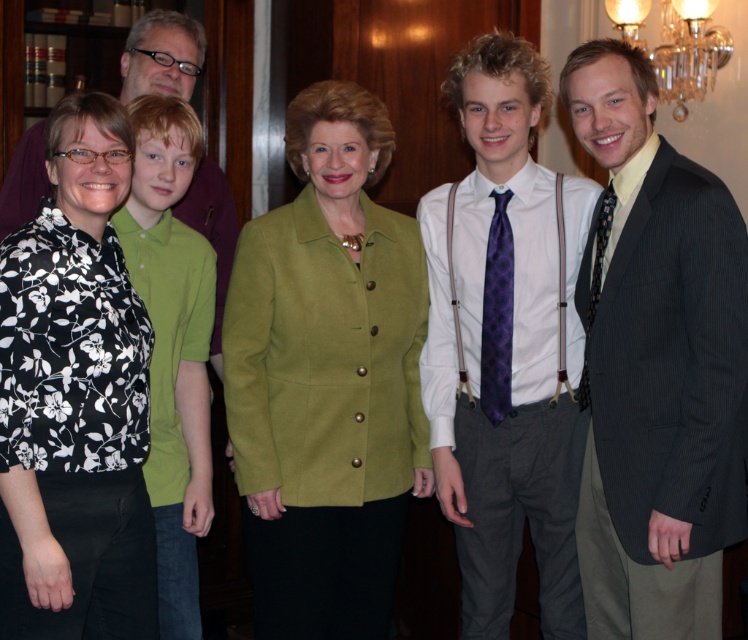
In the image, there are several people posing for a photo. The scene includes a woman in a black floral blouse at left and a young boy in a green short sleeved shirt and jeans. Where is the point at coordinate (73, 397) located in relation to these individuals?

The point at coordinate (73, 397) corresponds to the black floral blouse at left.

You are a photographer setting up for a group photo. You notice the clear crystal chandelier at upper right and the purple woven tie at center. Which object should you adjust your camera focus to first if you want to capture both in the same frame without moving the camera?

You should focus on the purple woven tie at center first because the clear crystal chandelier at upper right is to the right of it, so adjusting focus starting from the center ensures both are in frame.